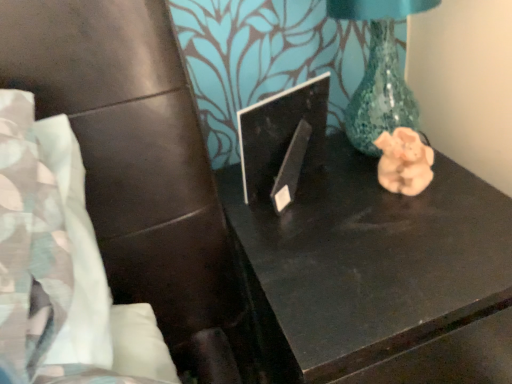
Measure the distance between black glossy laptop at center and camera.

24.71 inches.

This screenshot has height=384, width=512. In order to click on pink clay pig at right in this screenshot , I will do `click(404, 162)`.

Find the location of a particular element. Image resolution: width=512 pixels, height=384 pixels. black glossy laptop at center is located at coordinates (280, 129).

From the image's perspective, which is above, black glossy laptop at center or pink clay pig at right?

black glossy laptop at center, from the image's perspective.

Does black glossy laptop at center have a lesser width compared to pink clay pig at right?

In fact, black glossy laptop at center might be wider than pink clay pig at right.

Is black glossy laptop at center aimed at pink clay pig at right?

Yes.

At what (x,y) coordinates should I click in order to perform the action: click on table to the left of pink clay pig at right. Please return your answer as a coordinate pair (x, y). The image size is (512, 384). Looking at the image, I should click on (368, 263).

Is black glossy table at center in contact with pink clay pig at right?

There is a gap between black glossy table at center and pink clay pig at right.

Considering the relative positions of black glossy table at center and pink clay pig at right in the image provided, is black glossy table at center to the left of pink clay pig at right from the viewer's perspective?

Yes.

Looking at the image, does black glossy laptop at center seem bigger or smaller compared to black glossy table at center?

Clearly, black glossy laptop at center is smaller in size than black glossy table at center.

From a real-world perspective, is black glossy laptop at center above or below black glossy table at center?

black glossy laptop at center is above black glossy table at center.

Is black glossy laptop at center far from black glossy table at center?

No, black glossy laptop at center is not far away from black glossy table at center.

Is black glossy table at center at the back of black glossy laptop at center?

That's not correct — black glossy laptop at center is not looking away from black glossy table at center.

Who is bigger, black glossy table at center or black glossy laptop at center?

black glossy table at center.

Who is shorter, black glossy table at center or black glossy laptop at center?

Standing shorter between the two is black glossy laptop at center.

Is black glossy table at center wider than black glossy laptop at center?

Correct, the width of black glossy table at center exceeds that of black glossy laptop at center.

From a real-world perspective, is black glossy table at center located higher than black glossy laptop at center?

No.

Could you tell me if pink clay pig at right is turned towards black glossy laptop at center?

No, pink clay pig at right is not turned towards black glossy laptop at center.

From a real-world perspective, does pink clay pig at right stand above black glossy laptop at center?

No, from a real-world perspective, pink clay pig at right is not on top of black glossy laptop at center.

Can we say pink clay pig at right lies outside black glossy laptop at center?

Yes, pink clay pig at right is outside of black glossy laptop at center.

Measure the distance from pink clay pig at right to black glossy table at center.

The distance of pink clay pig at right from black glossy table at center is 6.29 inches.

Which point is more distant from viewer, (376,140) or (504,232)?

The point (376,140) is more distant.

Which of these two, pink clay pig at right or black glossy table at center, is bigger?

black glossy table at center is bigger.

From the image's perspective, would you say pink clay pig at right is shown under black glossy table at center?

No, from the image's perspective, pink clay pig at right is not beneath black glossy table at center.

This screenshot has height=384, width=512. In order to click on animal that appears on the right of black glossy laptop at center in this screenshot , I will do `click(404, 162)`.

Image resolution: width=512 pixels, height=384 pixels. I want to click on animal located behind the black glossy table at center, so click(404, 162).

Considering their positions, is black glossy laptop at center positioned further to black glossy table at center than pink clay pig at right?

black glossy laptop at center lies further to black glossy table at center than the other object.

Estimate the real-world distances between objects in this image. Which object is further from black glossy laptop at center, pink clay pig at right or black glossy table at center?

black glossy table at center lies further to black glossy laptop at center than the other object.

When comparing their distances from black glossy laptop at center, does black glossy table at center or pink clay pig at right seem further?

black glossy table at center lies further to black glossy laptop at center than the other object.

Considering their positions, is black glossy laptop at center positioned further to pink clay pig at right than black glossy table at center?

black glossy laptop at center is further to pink clay pig at right.

Which object lies further to the anchor point pink clay pig at right, black glossy table at center or black glossy laptop at center?

The object further to pink clay pig at right is black glossy laptop at center.

Based on their spatial positions, is pink clay pig at right or black glossy laptop at center closer to black glossy table at center?

Among the two, pink clay pig at right is located nearer to black glossy table at center.

Identify the location of animal between black glossy laptop at center and black glossy table at center vertically. (404, 162).